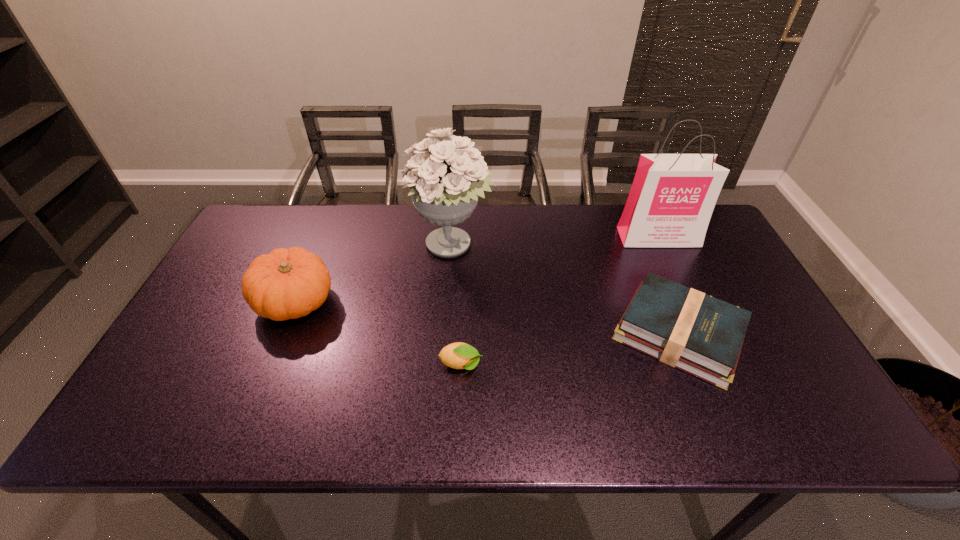
Find the location of a particular element. The image size is (960, 540). free region at the far left corner of the desktop is located at coordinates 277,244.

Image resolution: width=960 pixels, height=540 pixels. Find the location of `free space at the near left corner of the desktop`. free space at the near left corner of the desktop is located at coordinates (138, 429).

In the image, there is a desktop. At what (x,y) coordinates should I click in order to perform the action: click on vacant space at the far right corner. Please return your answer as a coordinate pair (x, y). This screenshot has height=540, width=960. Looking at the image, I should click on (708, 226).

This screenshot has height=540, width=960. I want to click on vacant point located between the hardback book and the lemon, so click(x=569, y=349).

Where is `vacant space that is in between the bouquet and the hardback book`? Image resolution: width=960 pixels, height=540 pixels. vacant space that is in between the bouquet and the hardback book is located at coordinates tap(565, 290).

You are a GUI agent. You are given a task and a screenshot of the screen. Output one action in this format:
    pyautogui.click(x=<x>, y=<y>)
    Task: Click on the free space between the pumpkin and the hardback book
    The width and height of the screenshot is (960, 540).
    Given the screenshot: What is the action you would take?
    (487, 318)

Where is `free space between the lemon and the bouquet`? The width and height of the screenshot is (960, 540). free space between the lemon and the bouquet is located at coordinates (457, 306).

What are the coordinates of `free space between the bouquet and the shopping bag` in the screenshot? It's located at (555, 242).

Locate an element on the screen. The width and height of the screenshot is (960, 540). free space that is in between the hardback book and the bouquet is located at coordinates (565, 290).

Find the location of a particular element. free area in between the lemon and the hardback book is located at coordinates (569, 349).